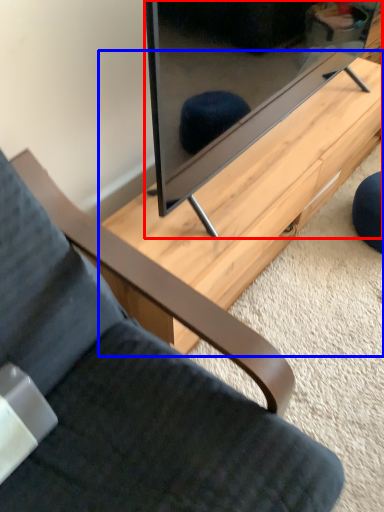
Question: Which object is closer to the camera taking this photo, television (highlighted by a red box) or table (highlighted by a blue box)?

Choices:
 (A) television
 (B) table

Answer: (A)